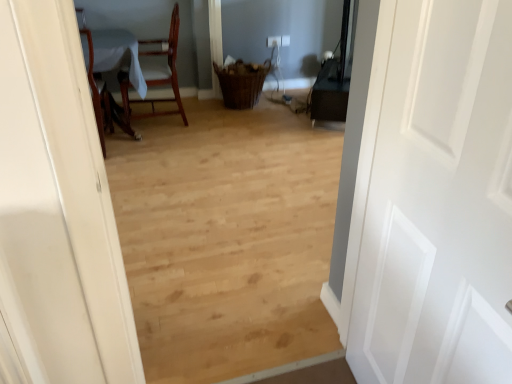
Question: Is wooden table at left facing away from mahogany wood chair at upper left?

Choices:
 (A) no
 (B) yes

Answer: (A)

Question: From the image's perspective, is wooden table at left beneath mahogany wood chair at upper left?

Choices:
 (A) yes
 (B) no

Answer: (A)

Question: Does wooden table at left have a greater height compared to mahogany wood chair at upper left?

Choices:
 (A) no
 (B) yes

Answer: (A)

Question: From the image's perspective, is wooden table at left on mahogany wood chair at upper left?

Choices:
 (A) no
 (B) yes

Answer: (A)

Question: Is wooden table at left surrounding mahogany wood chair at upper left?

Choices:
 (A) no
 (B) yes

Answer: (A)

Question: Is mahogany wood chair at upper left bigger or smaller than white matte door at right?

Choices:
 (A) small
 (B) big

Answer: (B)

Question: In terms of height, does mahogany wood chair at upper left look taller or shorter compared to white matte door at right?

Choices:
 (A) short
 (B) tall

Answer: (A)

Question: From a real-world perspective, relative to white matte door at right, is mahogany wood chair at upper left vertically above or below?

Choices:
 (A) above
 (B) below

Answer: (B)

Question: Relative to white matte door at right, is mahogany wood chair at upper left in front or behind?

Choices:
 (A) front
 (B) behind

Answer: (B)

Question: Is wooden table at left taller or shorter than white matte door at right?

Choices:
 (A) short
 (B) tall

Answer: (A)

Question: From the image's perspective, is wooden table at left positioned above or below white matte door at right?

Choices:
 (A) below
 (B) above

Answer: (B)

Question: Is wooden table at left bigger or smaller than white matte door at right?

Choices:
 (A) big
 (B) small

Answer: (A)

Question: Visually, is wooden table at left positioned to the left or to the right of white matte door at right?

Choices:
 (A) left
 (B) right

Answer: (A)

Question: Considering the relative positions of mahogany wood chair at upper left and wooden table at left in the image provided, is mahogany wood chair at upper left to the left or to the right of wooden table at left?

Choices:
 (A) right
 (B) left

Answer: (A)

Question: In terms of height, does mahogany wood chair at upper left look taller or shorter compared to wooden table at left?

Choices:
 (A) tall
 (B) short

Answer: (A)